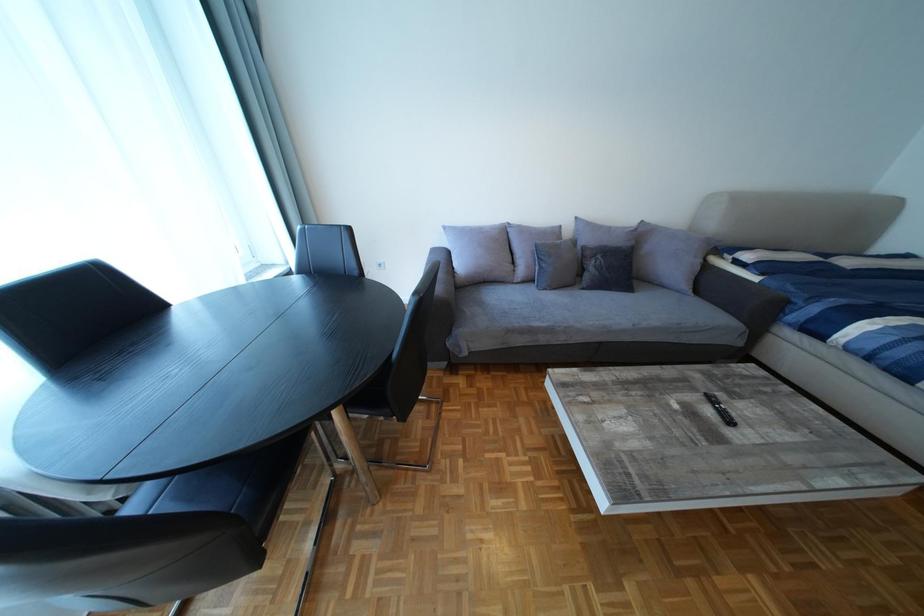
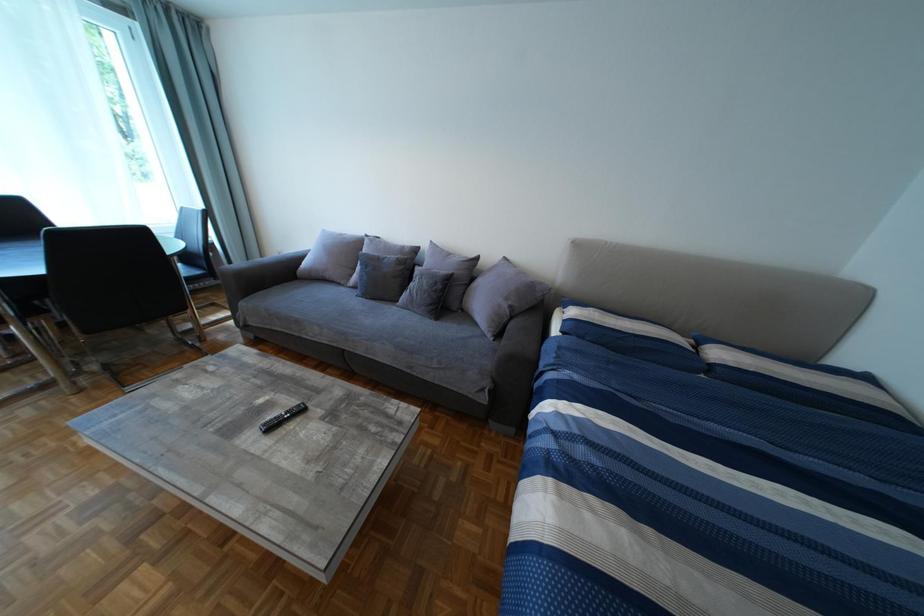
Question: In a continuous first-person perspective shot, in which direction is the camera moving?

Choices:
 (A) Left
 (B) Right
 (C) Forward
 (D) Backward

Answer: (B)